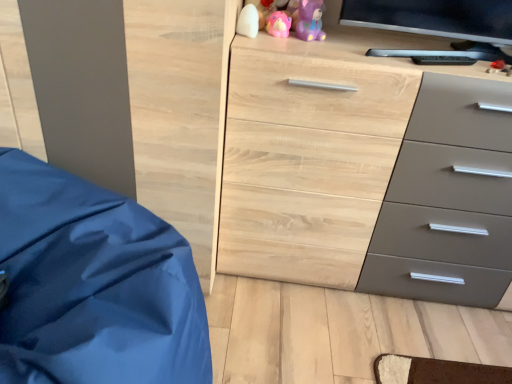
Identify the location of vacant area that is in front of pink rubber duck at upper center, the second toy from the left. This screenshot has height=384, width=512. (282, 42).